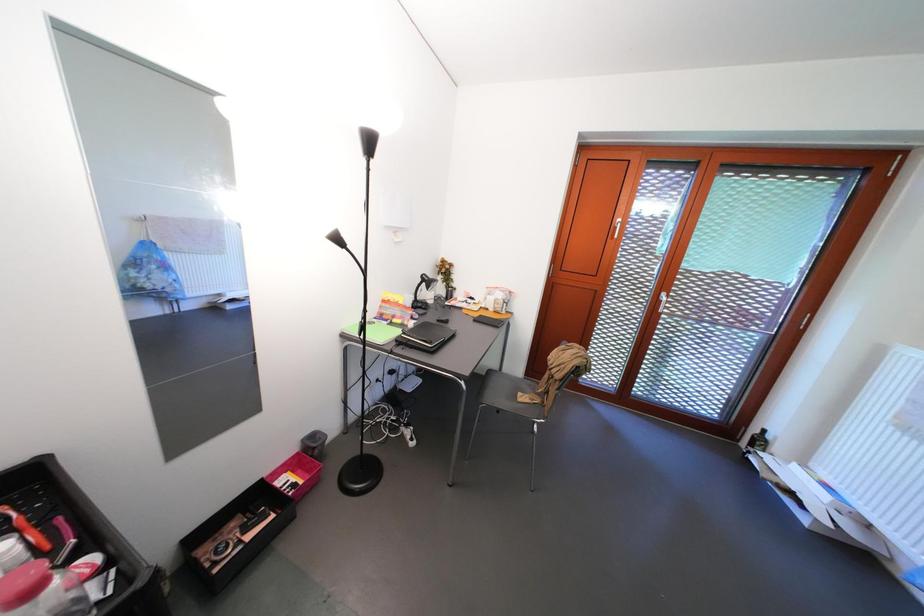
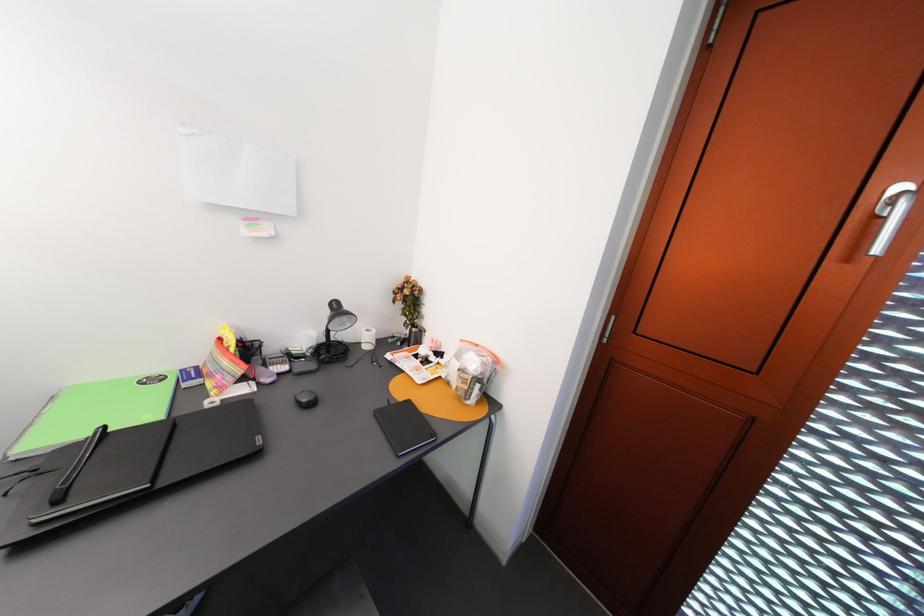
Looking at this image, which direction would the cameraman need to move to produce the second image?

The cameraman moved toward right, forward.